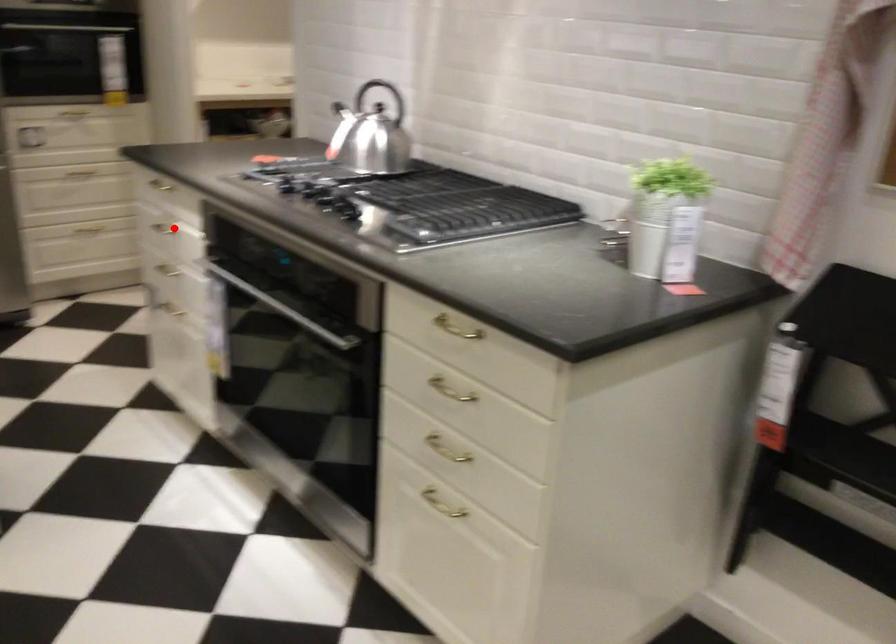
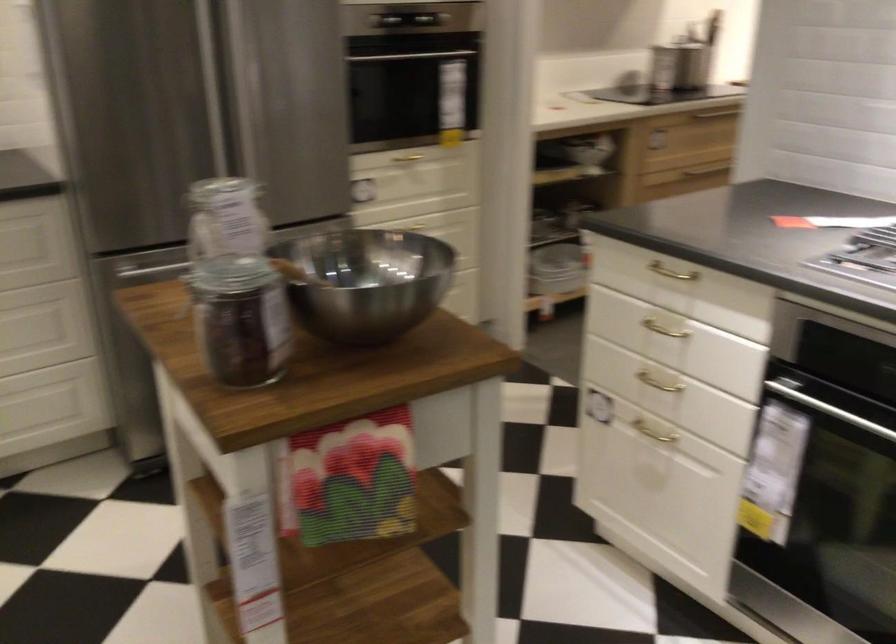
Where in the second image is the point corresponding to the highlighted location from the first image?

(664, 328)